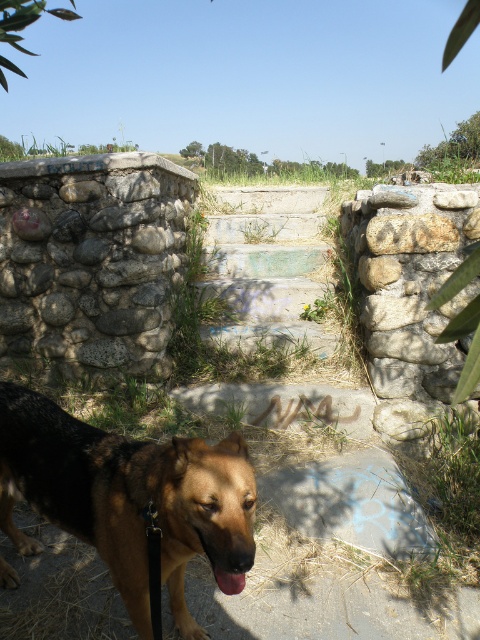
You are a person standing at the bottom of the steps. You see the gray rough stone at center and the brown matte dog mouth at lower center. Which object is located higher up in the scene?

The gray rough stone at center is positioned over the brown matte dog mouth at lower center, so the gray rough stone at center is higher up in the scene.

You are a small toy that is 10 cm wide. You want to place yourself on either the gray rough stone at center or the brown matte dog mouth at lower center. Which surface can you fit on without exceeding its width?

The gray rough stone at center has a greater width than the brown matte dog mouth at lower center. Since the toy is 10 cm wide, it can fit on both surfaces, but the gray rough stone at center would provide more space.

You are a painter who wants to paint both the natural stone wall at upper left and the brown matte dog mouth at lower center. Which object requires a larger brush to cover its width?

The natural stone wall at upper left might be wider than the brown matte dog mouth at lower center, so it requires a larger brush to cover its width.